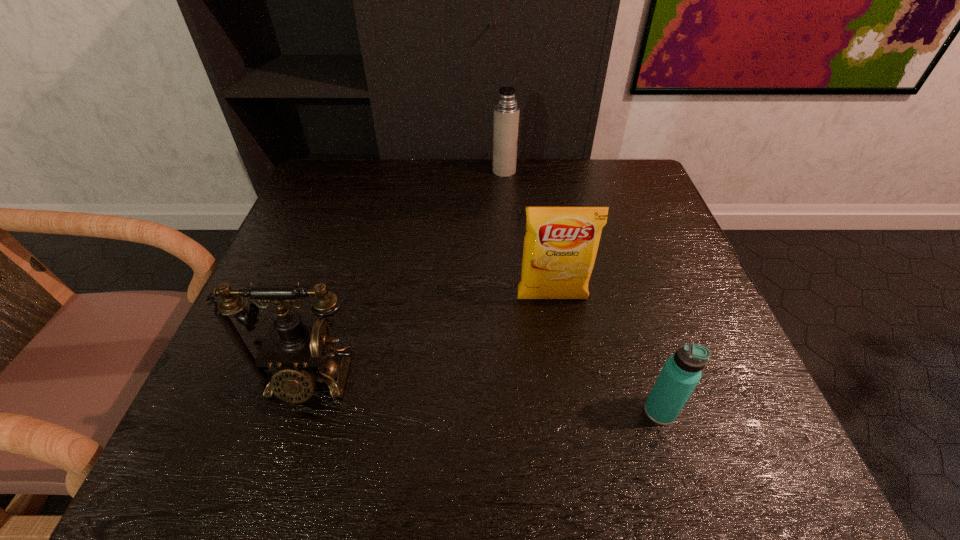
The height and width of the screenshot is (540, 960). I want to click on vacant region that satisfies the following two spatial constraints: 1. on the front of the shortest object with the logo; 2. on the left side of the crisp (potato chip), so click(569, 411).